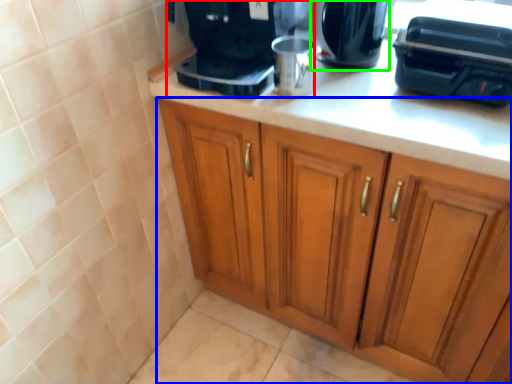
Question: Which object is positioned farthest from home appliance (highlighted by a red box)? Select from cabinetry (highlighted by a blue box) and kitchen appliance (highlighted by a green box).

Choices:
 (A) cabinetry
 (B) kitchen appliance

Answer: (A)